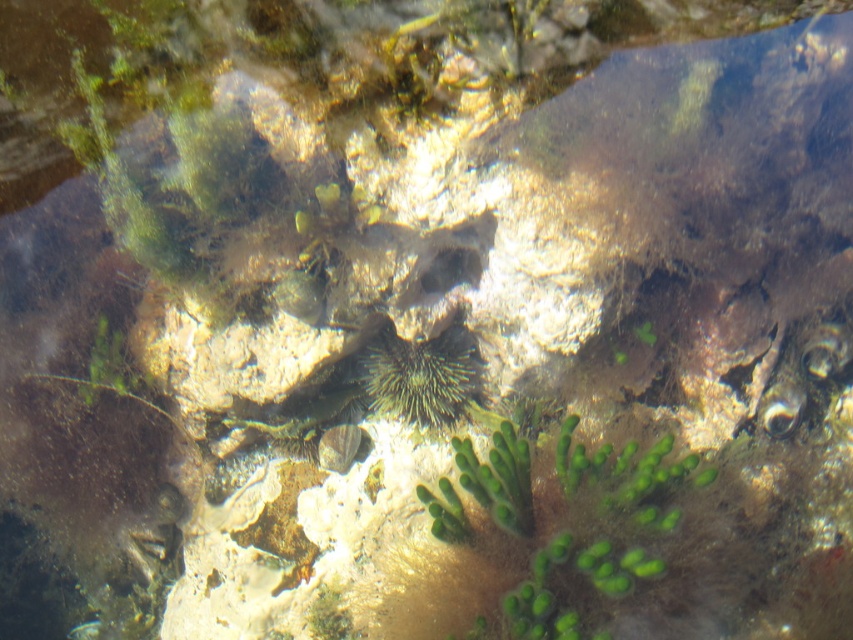
You are a marine biologist observing an underwater scene. You notice the green fuzzy algae at center and the green spiny at center. Based on their positions, which one is closer to the surface of the water?

The green spiny at center is closer to the surface of the water because the green fuzzy algae at center is located below it.

Looking at this image, you are a diver exploring this underwater scene. You notice two points marked in the image. Which point is closer to you, point (x=482, y=538) or point (x=457, y=332)?

Point (x=482, y=538) is closer to the viewer than point (x=457, y=332).